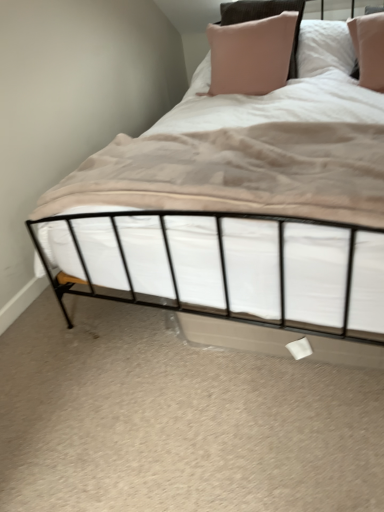
Question: Considering their positions, is pink fabric pillow at upper center located in front of or behind beige soft fabric at center?

Choices:
 (A) front
 (B) behind

Answer: (B)

Question: In terms of size, does pink fabric pillow at upper center appear bigger or smaller than beige soft fabric at center?

Choices:
 (A) big
 (B) small

Answer: (A)

Question: Considering the positions of pink fabric pillow at upper center and beige soft fabric at center in the image, is pink fabric pillow at upper center wider or thinner than beige soft fabric at center?

Choices:
 (A) wide
 (B) thin

Answer: (B)

Question: In terms of width, does beige soft fabric at center look wider or thinner when compared to pink fabric pillow at upper center?

Choices:
 (A) wide
 (B) thin

Answer: (A)

Question: From the image's perspective, is beige soft fabric at center above or below pink fabric pillow at upper center?

Choices:
 (A) above
 (B) below

Answer: (B)

Question: Considering the positions of beige soft fabric at center and pink fabric pillow at upper center in the image, is beige soft fabric at center taller or shorter than pink fabric pillow at upper center?

Choices:
 (A) tall
 (B) short

Answer: (B)

Question: Is beige soft fabric at center situated inside pink fabric pillow at upper center or outside?

Choices:
 (A) inside
 (B) outside

Answer: (B)